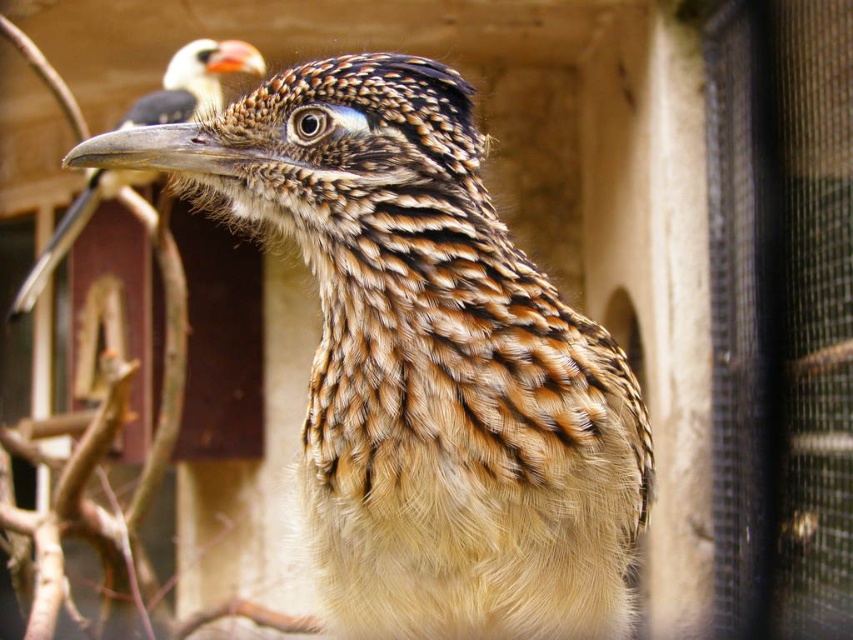
You are observing two points in the image of a bird. The first point is at coordinates point (473, 138) and the second is at point (47, 269). Based on their positions, which point is nearer to you?

Point (473, 138) is closer to the camera than point (47, 269).

You are an ornithologist observing the brown speckled feathers at center and the speckled feathered bird at upper left in the image. Based on their positions, which object is located to the right side of the other?

The brown speckled feathers at center is to the right of the speckled feathered bird at upper left.